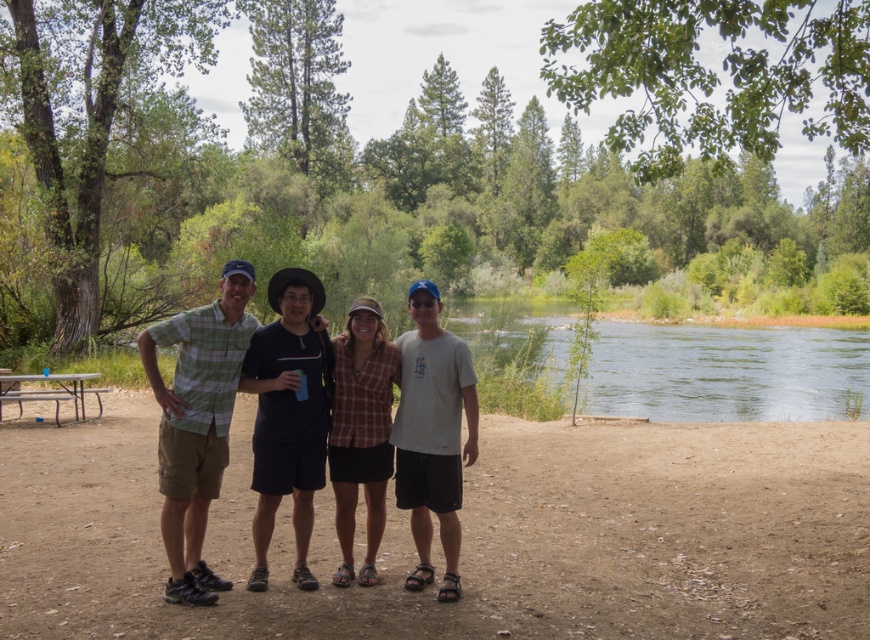
Based on the scene description, where is the green plaid shirt at center located in the image?

A: The green plaid shirt at center is located at point (197, 422).

You are planning to take a photo of the group standing near the river. The photographer wants to ensure that the green plaid shirt at center and the metallic silver picnic table at lower left are both visible in the frame. Given their sizes, which object should be placed closer to the camera to ensure both are fully visible?

The green plaid shirt at center is smaller than the metallic silver picnic table at lower left. To ensure both are fully visible in the photo, the photographer should place the metallic silver picnic table at lower left closer to the camera since it is larger and requires more space in the frame.